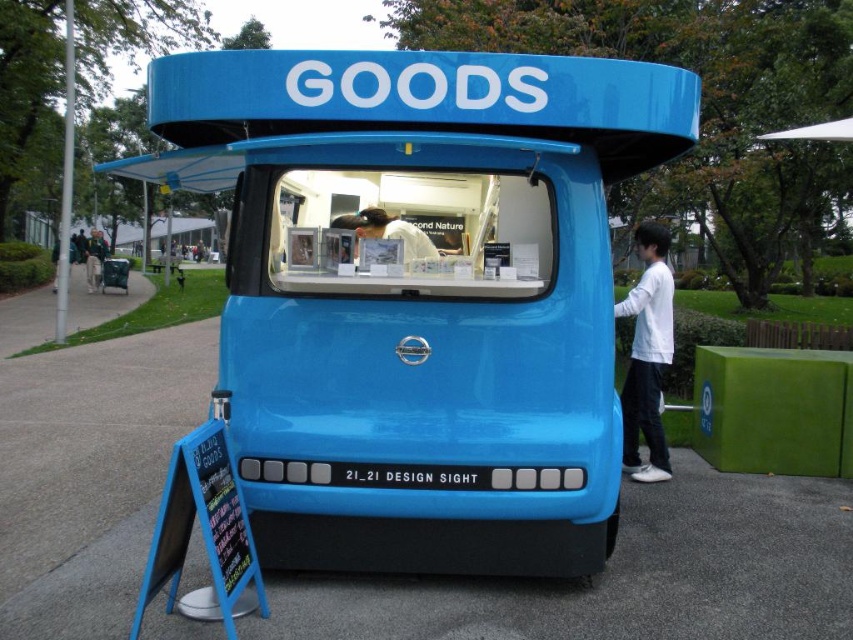
Does white matte shirt at right have a smaller size compared to light brown wooden bench at lower left?

Yes, white matte shirt at right is smaller than light brown wooden bench at lower left.

Is point (653, 449) positioned behind point (102, 262)?

That is False.

Which is in front, point (648, 481) or point (96, 257)?

Point (648, 481) is in front.

At what (x,y) coordinates should I click in order to perform the action: click on white matte shirt at right. Please return your answer as a coordinate pair (x, y). This screenshot has width=853, height=640. Looking at the image, I should click on (647, 355).

Can you confirm if blue glossy truck at center is positioned above white matte shirt at right?

Yes, blue glossy truck at center is above white matte shirt at right.

Does blue glossy truck at center have a lesser height compared to white matte shirt at right?

Incorrect, blue glossy truck at center's height does not fall short of white matte shirt at right's.

Describe the element at coordinates (421, 296) in the screenshot. I see `blue glossy truck at center` at that location.

The image size is (853, 640). Find the location of `blue glossy truck at center`. blue glossy truck at center is located at coordinates (421, 296).

Is blue glossy truck at center bigger than light brown wooden bench at lower left?

Incorrect, blue glossy truck at center is not larger than light brown wooden bench at lower left.

Is blue glossy truck at center positioned before light brown wooden bench at lower left?

Yes, it is in front of light brown wooden bench at lower left.

Measure the distance between point (485, 291) and camera.

The distance of point (485, 291) from camera is 3.66 meters.

Find the location of a particular element. Image resolution: width=853 pixels, height=640 pixels. blue glossy truck at center is located at coordinates (421, 296).